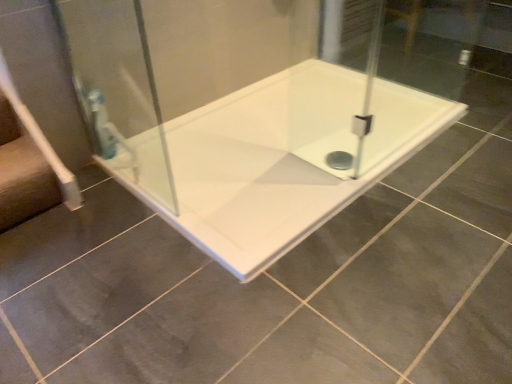
Measure the distance between point (168,199) and camera.

Point (168,199) is 4.99 feet from camera.

The image size is (512, 384). In order to click on clear glass shower door at left in this screenshot , I will do `click(118, 90)`.

Describe the element at coordinates (118, 90) in the screenshot. The width and height of the screenshot is (512, 384). I see `clear glass shower door at left` at that location.

What do you see at coordinates (280, 159) in the screenshot? The width and height of the screenshot is (512, 384). I see `white glossy bathtub at center` at bounding box center [280, 159].

I want to click on white glossy bathtub at center, so click(x=280, y=159).

Locate an element on the screen. Image resolution: width=512 pixels, height=384 pixels. clear glass shower door at left is located at coordinates (118, 90).

Looking at this image, which object is positioned more to the left, clear glass shower door at left or white glossy bathtub at center?

clear glass shower door at left.

In the image, is clear glass shower door at left positioned in front of or behind white glossy bathtub at center?

In the image, clear glass shower door at left appears in front of white glossy bathtub at center.

Which is behind, point (78, 91) or point (293, 224)?

The point (78, 91) is farther.

From the image's perspective, does clear glass shower door at left appear lower than white glossy bathtub at center?

No, from the image's perspective, clear glass shower door at left is not below white glossy bathtub at center.

From a real-world perspective, is clear glass shower door at left above or below white glossy bathtub at center?

Clearly, from a real-world perspective, clear glass shower door at left is above white glossy bathtub at center.

Considering the relative sizes of clear glass shower door at left and white glossy bathtub at center in the image provided, is clear glass shower door at left wider than white glossy bathtub at center?

In fact, clear glass shower door at left might be narrower than white glossy bathtub at center.

Can you confirm if clear glass shower door at left is taller than white glossy bathtub at center?

Correct, clear glass shower door at left is much taller as white glossy bathtub at center.

Can you confirm if clear glass shower door at left is smaller than white glossy bathtub at center?

Indeed, clear glass shower door at left has a smaller size compared to white glossy bathtub at center.

Would you say clear glass shower door at left is inside or outside white glossy bathtub at center?

clear glass shower door at left is not inside white glossy bathtub at center, it's outside.

Is clear glass shower door at left far away from white glossy bathtub at center?

No, clear glass shower door at left is not far away from white glossy bathtub at center.

Does clear glass shower door at left turn towards white glossy bathtub at center?

Yes, clear glass shower door at left is turned towards white glossy bathtub at center.

How many degrees apart are the facing directions of clear glass shower door at left and white glossy bathtub at center?

The angular difference between clear glass shower door at left and white glossy bathtub at center is 90 degrees.

At what (x,y) coordinates should I click in order to perform the action: click on shower door on the left of white glossy bathtub at center. Please return your answer as a coordinate pair (x, y). Looking at the image, I should click on (118, 90).

Is white glossy bathtub at center to the left of clear glass shower door at left from the viewer's perspective?

Incorrect, white glossy bathtub at center is not on the left side of clear glass shower door at left.

In the scene shown: Does white glossy bathtub at center come in front of clear glass shower door at left?

No, white glossy bathtub at center is further to the viewer.

Considering the positions of point (283, 210) and point (115, 156), is point (283, 210) closer or farther from the camera than point (115, 156)?

Point (283, 210).

From the image's perspective, is white glossy bathtub at center above or below clear glass shower door at left?

Based on their image positions, white glossy bathtub at center is located beneath clear glass shower door at left.

From a real-world perspective, is white glossy bathtub at center positioned under clear glass shower door at left based on gravity?

Yes.

Which of these two, white glossy bathtub at center or clear glass shower door at left, is thinner?

With smaller width is clear glass shower door at left.

Does white glossy bathtub at center have a greater height compared to clear glass shower door at left?

No, white glossy bathtub at center is not taller than clear glass shower door at left.

Looking at the image, does white glossy bathtub at center seem bigger or smaller compared to clear glass shower door at left?

In the image, white glossy bathtub at center appears to be larger than clear glass shower door at left.

Is white glossy bathtub at center positioned beyond the bounds of clear glass shower door at left?

Yes.

Is white glossy bathtub at center touching clear glass shower door at left?

No, white glossy bathtub at center is not beside clear glass shower door at left.

Is white glossy bathtub at center facing away from clear glass shower door at left?

white glossy bathtub at center is not turned away from clear glass shower door at left.

How many degrees apart are the facing directions of white glossy bathtub at center and clear glass shower door at left?

The facing directions of white glossy bathtub at center and clear glass shower door at left are 90 degrees apart.

In the image, there is a clear glass shower door at left. Where is `bathtub below it (from a real-world perspective)`? bathtub below it (from a real-world perspective) is located at coordinates (280, 159).

Locate an element on the screen. This screenshot has width=512, height=384. shower door above the white glossy bathtub at center (from a real-world perspective) is located at coordinates (118, 90).

The width and height of the screenshot is (512, 384). I want to click on shower door lying above the white glossy bathtub at center (from the image's perspective), so click(118, 90).